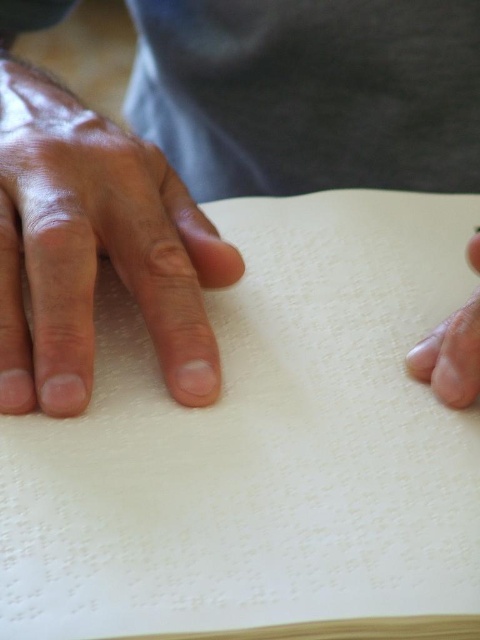
You are a teacher preparing a Braille reading material for your students. You have two papers in front of you, the white paper at center and the smooth paper at center. Which paper has more area to write Braille text on?

The smooth paper at center has more area to write Braille text on because it occupies more space than the white paper at center.

You are a visually impaired person trying to locate the white paper at center in the image. Based on the coordinates provided, can you estimate its position relative to the edges of the frame?

The white paper at center is located at coordinates point (261, 444), which means it is positioned slightly to the right and center of the frame.